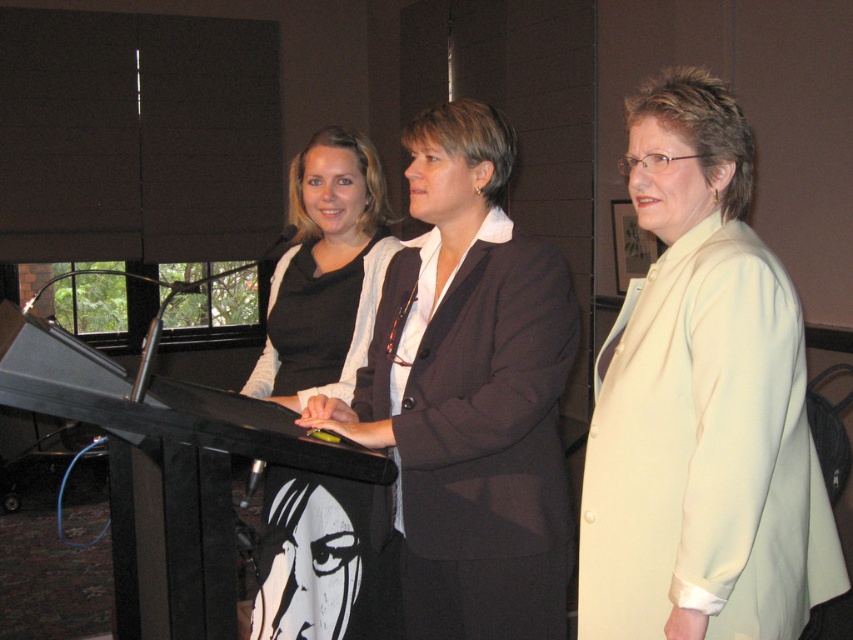
Question: Does white satin blazer at center appear on the right side of matte black dress at center?

Choices:
 (A) no
 (B) yes

Answer: (B)

Question: Is matte black blazer at center behind matte black dress at center?

Choices:
 (A) yes
 (B) no

Answer: (B)

Question: Which point is farther to the camera?

Choices:
 (A) white satin blazer at center
 (B) matte black dress at center
 (C) matte black blazer at center

Answer: (B)

Question: Does white satin blazer at center come behind matte black dress at center?

Choices:
 (A) no
 (B) yes

Answer: (A)

Question: Among these points, which one is nearest to the camera?

Choices:
 (A) (111, 378)
 (B) (352, 147)
 (C) (431, 513)
 (D) (729, 116)

Answer: (D)

Question: Which of the following is the farthest from the observer?

Choices:
 (A) black wood podium at center
 (B) matte black dress at center
 (C) white satin blazer at center
 (D) matte black blazer at center

Answer: (B)